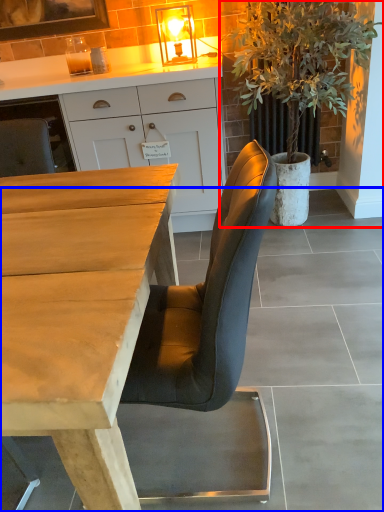
Question: Which point is closer to the camera, houseplant (highlighted by a red box) or concrete (highlighted by a blue box)?

Choices:
 (A) houseplant
 (B) concrete

Answer: (B)